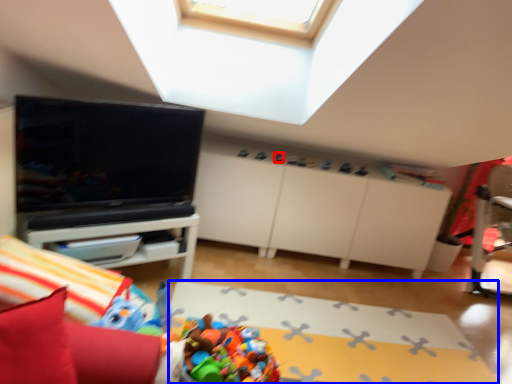
Question: Which point is closer to the camera, toy (highlighted by a red box) or plain (highlighted by a blue box)?

Choices:
 (A) toy
 (B) plain

Answer: (B)